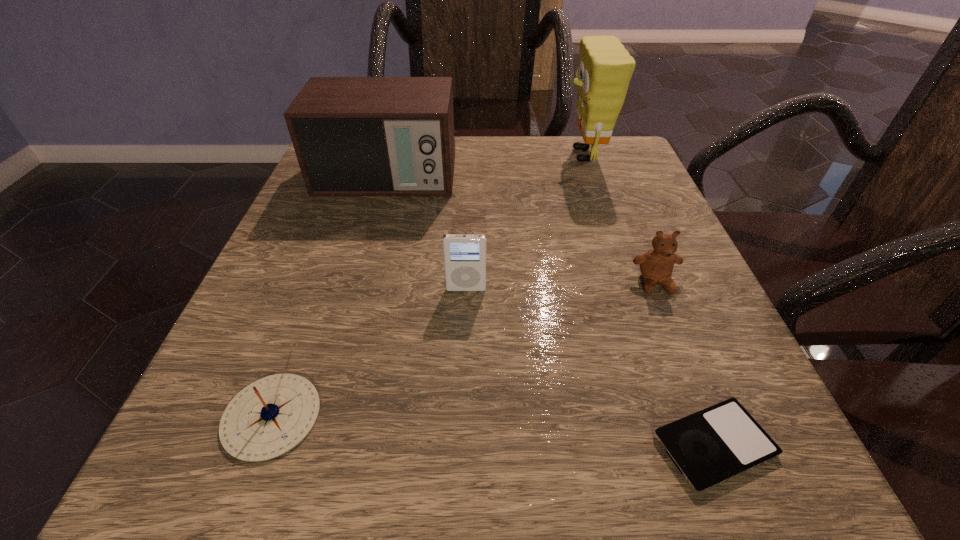
Where is `radio receiver that is positioned at the left edge`? radio receiver that is positioned at the left edge is located at coordinates (353, 136).

The width and height of the screenshot is (960, 540). Identify the location of compass located at the left edge. (269, 417).

At what (x,y) coordinates should I click in order to perform the action: click on sponge that is at the right edge. Please return your answer as a coordinate pair (x, y). Looking at the image, I should click on (605, 68).

The height and width of the screenshot is (540, 960). I want to click on teddy bear present at the right edge, so [x=656, y=266].

Identify the location of iPod that is at the right edge. This screenshot has height=540, width=960. (x=711, y=446).

Identify the location of object that is at the far left corner. (353, 136).

Where is `object present at the near left corner`? Image resolution: width=960 pixels, height=540 pixels. object present at the near left corner is located at coordinates (269, 417).

This screenshot has height=540, width=960. Find the location of `object situated at the far right corner`. object situated at the far right corner is located at coordinates (605, 68).

Locate an element on the screen. object that is at the near right corner is located at coordinates (711, 446).

Locate an element on the screen. vacant space at the far edge of the desktop is located at coordinates (500, 181).